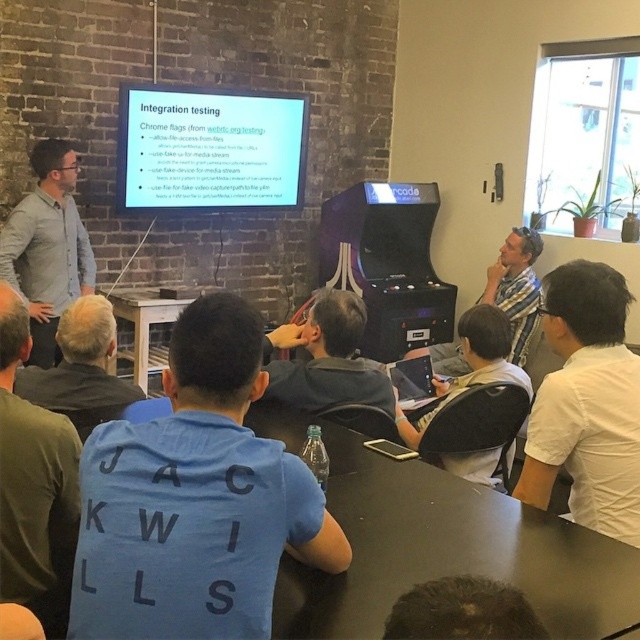
You are standing in the room and want to place a new object on the table. The table is located at point (x=438, y=545). Where should you walk to reach the table?

The black matte table at lower center is located at point (x=438, y=545), so you should walk towards that coordinate to reach the table.

You are standing in the room and want to project a presentation onto the white glossy projector screen at upper center. However, there is a person wearing the dark gray shirt at lower center sitting directly in front of the screen. Based on their positions, will the person block the projection from reaching the screen?

The white glossy projector screen at upper center is taller than the dark gray shirt at lower center. Since the screen is taller, the person wearing the dark gray shirt at lower center may block part of the lower portion of the screen, but the upper part should remain visible.